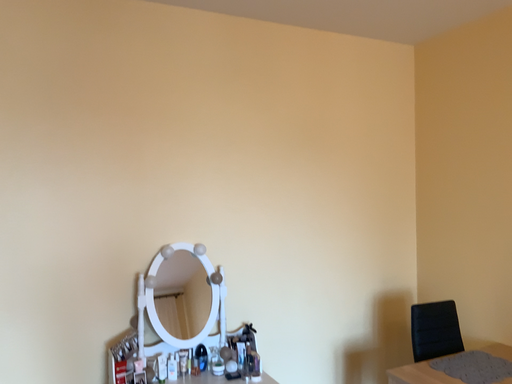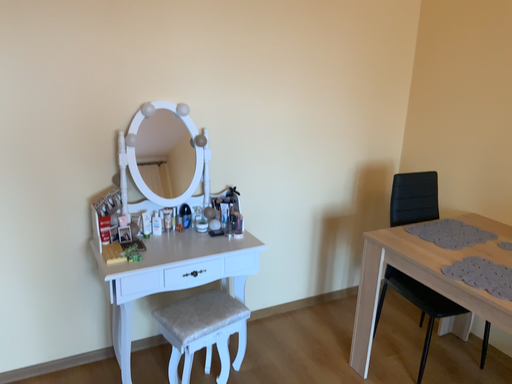
Question: Which way did the camera rotate in the video?

Choices:
 (A) rotated downward
 (B) rotated upward

Answer: (A)